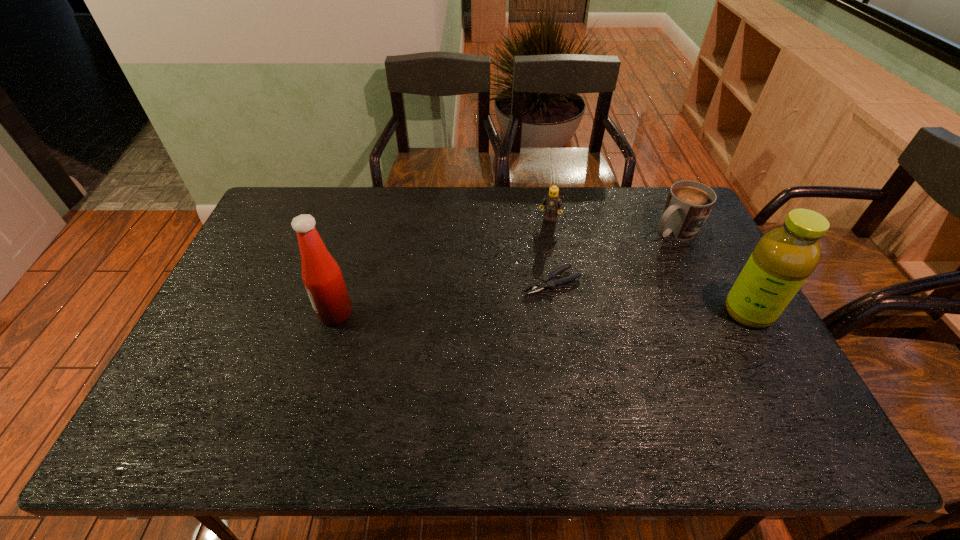
Locate an element on the screen. Image resolution: width=960 pixels, height=540 pixels. free space located on the side of the mug with the handle is located at coordinates (585, 284).

Where is `free space located in front of the Lego`? The width and height of the screenshot is (960, 540). free space located in front of the Lego is located at coordinates (521, 276).

Find the location of `blank space located 0.170m in front of the Lego`. blank space located 0.170m in front of the Lego is located at coordinates (531, 255).

Find the location of `free spot located 0.130m in front of the Lego`. free spot located 0.130m in front of the Lego is located at coordinates (535, 247).

Where is `free location located at the gripping part of the shortest object`? Image resolution: width=960 pixels, height=540 pixels. free location located at the gripping part of the shortest object is located at coordinates (510, 298).

Find the location of a particular element. The height and width of the screenshot is (540, 960). vacant region located at the gripping part of the shortest object is located at coordinates (408, 344).

This screenshot has width=960, height=540. What are the coordinates of `free region located at the gripping part of the shortest object` in the screenshot? It's located at (419, 339).

Where is `mug that is at the far edge`? This screenshot has width=960, height=540. mug that is at the far edge is located at coordinates (689, 203).

This screenshot has height=540, width=960. What are the coordinates of `Lego positioned at the far edge` in the screenshot? It's located at (552, 202).

At what (x,y) coordinates should I click in order to perform the action: click on fruit juice that is at the right edge. Please return your answer as a coordinate pair (x, y). This screenshot has height=540, width=960. Looking at the image, I should click on (782, 260).